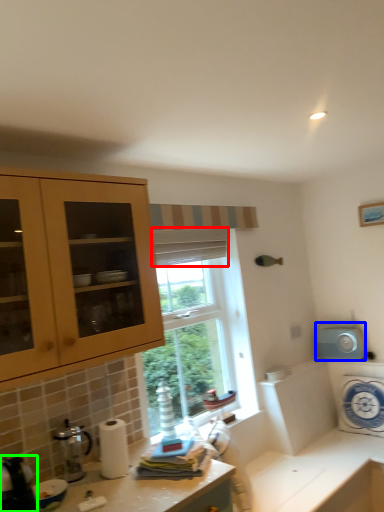
Question: Which is nearer to the curtain (highlighted by a red box)? appliance (highlighted by a blue box) or appliance (highlighted by a green box).

Choices:
 (A) appliance
 (B) appliance

Answer: (A)